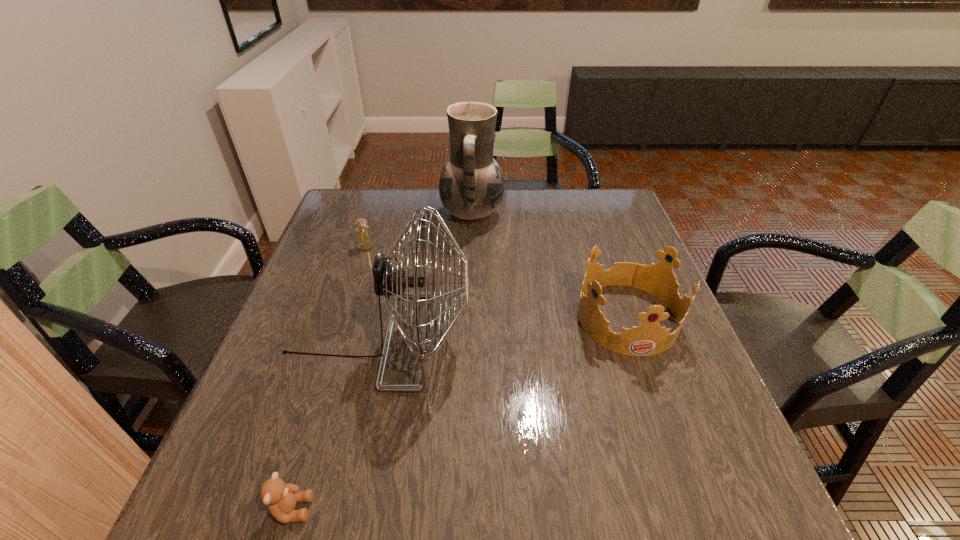
Locate an element on the screen. The width and height of the screenshot is (960, 540). free space at the left edge of the desktop is located at coordinates (298, 324).

Where is `blank space at the right edge of the desktop`? The image size is (960, 540). blank space at the right edge of the desktop is located at coordinates (660, 462).

In the image, there is a desktop. Identify the location of vacant space at the far left corner. This screenshot has width=960, height=540. (344, 224).

Locate an element on the screen. Image resolution: width=960 pixels, height=540 pixels. free space at the far right corner of the desktop is located at coordinates (602, 217).

Identify the location of vacant area at the near right corner of the desktop. The width and height of the screenshot is (960, 540). click(699, 483).

Identify the location of free area in between the pitcher and the third tallest object. [x=549, y=266].

Find the location of a particular element. The height and width of the screenshot is (540, 960). free space between the fan and the tiara is located at coordinates (502, 328).

Find the location of `vacant region between the third shortest object and the pitcher`. vacant region between the third shortest object and the pitcher is located at coordinates (549, 266).

At what (x,y) coordinates should I click in order to perform the action: click on vacant area between the fourth nearest object and the nearest object. Please return your answer as a coordinate pair (x, y). This screenshot has width=960, height=540. Looking at the image, I should click on (329, 377).

Where is `free spot between the third tallest object and the second farthest object`? free spot between the third tallest object and the second farthest object is located at coordinates (496, 282).